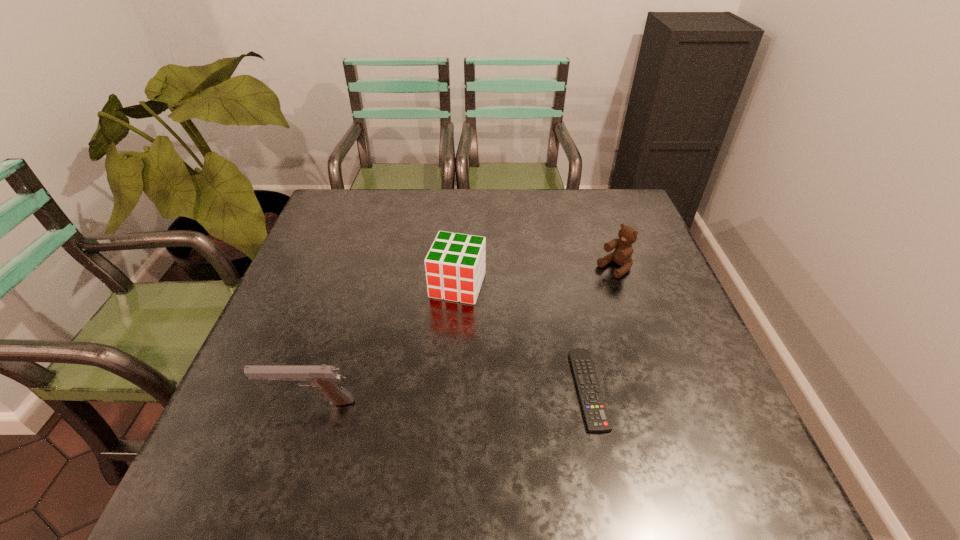
At what (x,y) coordinates should I click in order to perform the action: click on free spot on the desktop that is between the pistol and the second object from right to left and is positioned on the red face of the cube. Please return your answer as a coordinate pair (x, y). The image size is (960, 540). Looking at the image, I should click on [415, 397].

Where is `vacant spot on the desktop that is between the pistol and the remote control and is positioned on the face of the rightmost object`? Image resolution: width=960 pixels, height=540 pixels. vacant spot on the desktop that is between the pistol and the remote control and is positioned on the face of the rightmost object is located at coordinates (415, 397).